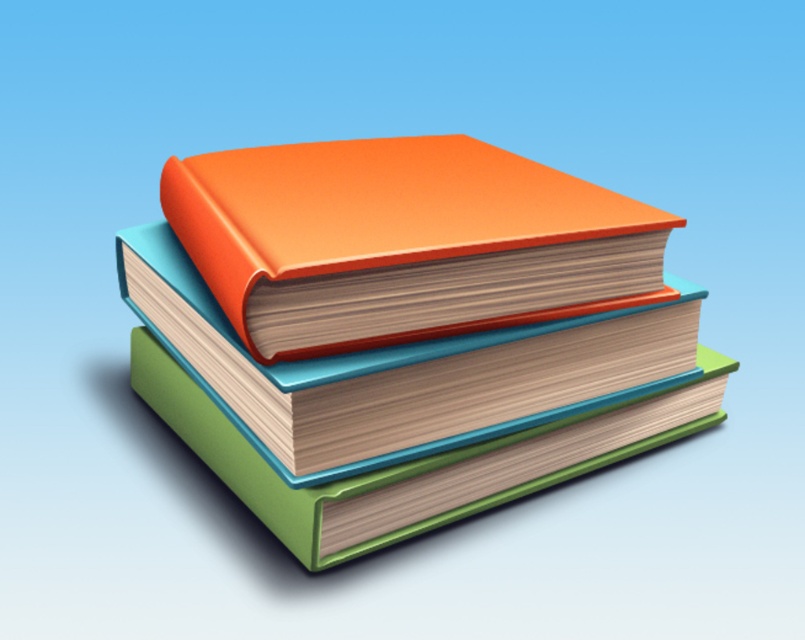
Is orange matte book at center to the left of orange matte hardback book at center from the viewer's perspective?

Incorrect, orange matte book at center is not on the left side of orange matte hardback book at center.

Is orange matte book at center closer to the viewer compared to orange matte hardback book at center?

No, orange matte book at center is behind orange matte hardback book at center.

I want to click on orange matte book at center, so click(407, 328).